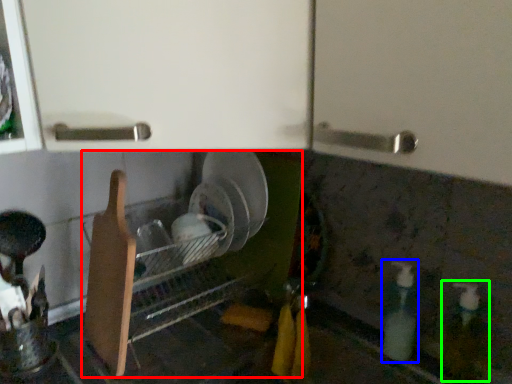
Question: Estimate the real-world distances between objects in this image. Which object is farther from dish washer (highlighted by a red box), bottle (highlighted by a blue box) or bottle (highlighted by a green box)?

Choices:
 (A) bottle
 (B) bottle

Answer: (B)